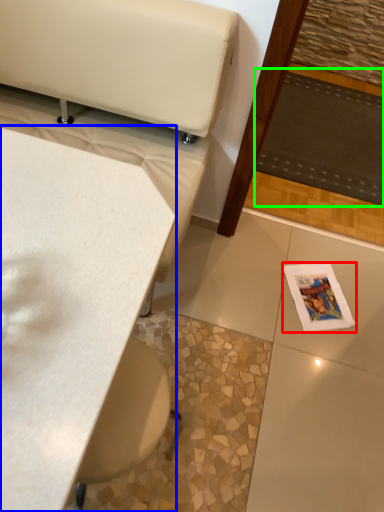
Question: Estimate the real-world distances between objects in this image. Which object is closer to magazine (highlighted by a red box), table (highlighted by a blue box) or mat (highlighted by a green box)?

Choices:
 (A) table
 (B) mat

Answer: (B)